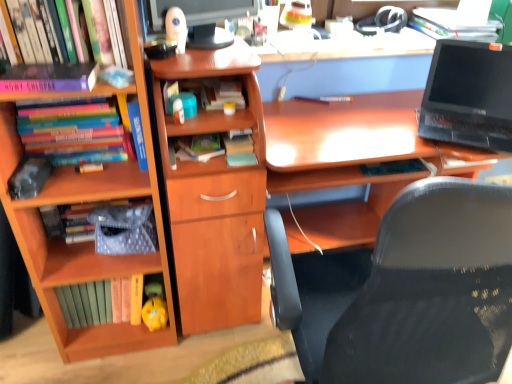
Question: Is hardcover book at center, the 5th book in the left-to-right sequence, in front of or behind hardcover books at left, which ranks as the second book in left-to-right order, in the image?

Choices:
 (A) front
 (B) behind

Answer: (B)

Question: Is point (237, 100) positioned closer to the camera than point (40, 134)?

Choices:
 (A) farther
 (B) closer

Answer: (A)

Question: Which object is positioned closest to the matte black monitor at upper center?

Choices:
 (A) wooden cabinet at center
 (B) yellow matte piggy bank at lower center
 (C) wooden desk at center
 (D) hardcover book at upper left, acting as the sixth book starting from the right
 (E) pink matte book at upper left, the fourth book viewed from the right

Answer: (A)

Question: Considering the real-world distances, which object is closest to the wooden bookcase at left?

Choices:
 (A) hardcover book at upper left, acting as the sixth book starting from the right
 (B) matte black monitor at upper center
 (C) hardcover book at center, the fourth book when ordered from left to right
 (D) black plastic laptop at right
 (E) black mesh chair at center

Answer: (C)